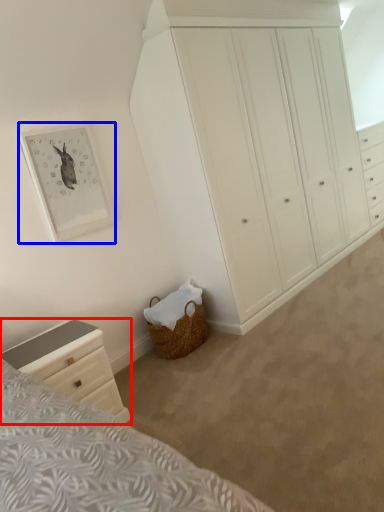
Question: Among these objects, which one is farthest to the camera, chest of drawers (highlighted by a red box) or picture frame (highlighted by a blue box)?

Choices:
 (A) chest of drawers
 (B) picture frame

Answer: (B)